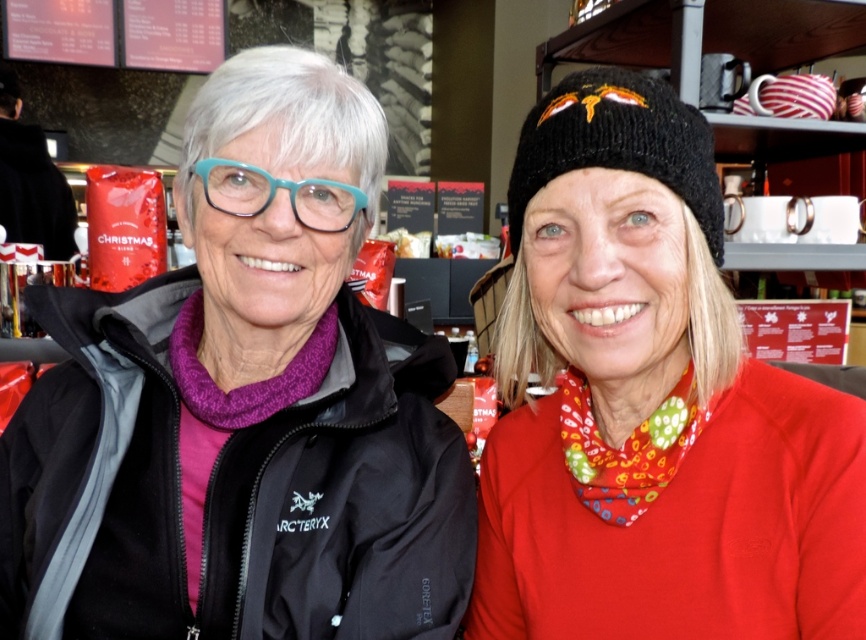
Can you confirm if black knitted beanie at upper center is taller than teal plastic glasses at center?

Indeed, black knitted beanie at upper center has a greater height compared to teal plastic glasses at center.

Where is `black knitted beanie at upper center`? black knitted beanie at upper center is located at coordinates (650, 404).

Is point (378, 550) more distant than point (750, 472)?

Yes, it is behind point (750, 472).

Between point (296, 595) and point (603, 301), which one is positioned behind?

Positioned behind is point (296, 595).

Is point (289, 296) closer to camera compared to point (582, 109)?

No.

Find the location of a particular element. black matte jacket at center is located at coordinates (243, 406).

Can you confirm if black knitted beanie at upper center is thinner than black knitted hat at upper right?

No, black knitted beanie at upper center is not thinner than black knitted hat at upper right.

Who is higher up, black knitted beanie at upper center or black knitted hat at upper right?

Positioned higher is black knitted hat at upper right.

You are a GUI agent. You are given a task and a screenshot of the screen. Output one action in this format:
    pyautogui.click(x=<x>, y=<y>)
    Task: Click on the black knitted beanie at upper center
    
    Given the screenshot: What is the action you would take?
    pyautogui.click(x=650, y=404)